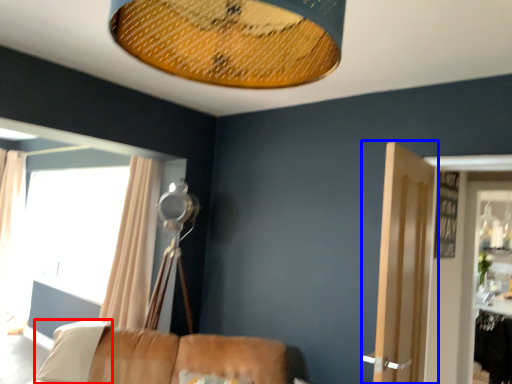
Question: Which object appears farthest to the camera in this image, pillow (highlighted by a red box) or door (highlighted by a blue box)?

Choices:
 (A) pillow
 (B) door

Answer: (A)